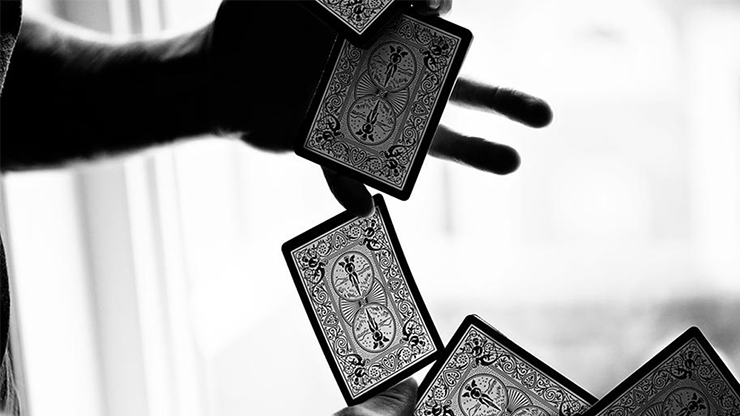
Where is `frame`? frame is located at coordinates (115, 224).